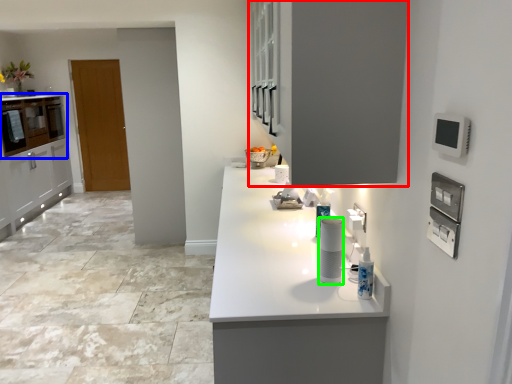
Question: Based on their relative distances, which object is farther from cabinetry (highlighted by a red box)? Choose from cabinetry (highlighted by a blue box) and appliance (highlighted by a green box).

Choices:
 (A) cabinetry
 (B) appliance

Answer: (A)